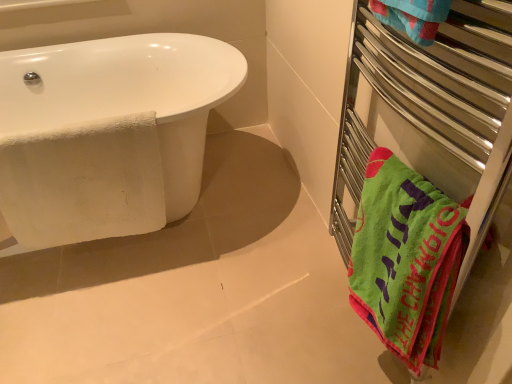
Question: Can you confirm if green soft towel at right is wider than green fabric towel at right?

Choices:
 (A) no
 (B) yes

Answer: (A)

Question: Considering the relative positions of green soft towel at right and green fabric towel at right in the image provided, is green soft towel at right to the right of green fabric towel at right from the viewer's perspective?

Choices:
 (A) no
 (B) yes

Answer: (A)

Question: Is there a large distance between green soft towel at right and green fabric towel at right?

Choices:
 (A) yes
 (B) no

Answer: (B)

Question: Is green soft towel at right at the left side of green fabric towel at right?

Choices:
 (A) no
 (B) yes

Answer: (B)

Question: Does green soft towel at right have a lesser height compared to green fabric towel at right?

Choices:
 (A) yes
 (B) no

Answer: (A)

Question: Does green soft towel at right have a larger size compared to green fabric towel at right?

Choices:
 (A) no
 (B) yes

Answer: (A)

Question: Can you confirm if white textured towel at left is wider than green soft towel at right?

Choices:
 (A) no
 (B) yes

Answer: (A)

Question: Does white textured towel at left lie in front of green soft towel at right?

Choices:
 (A) yes
 (B) no

Answer: (B)

Question: Can you confirm if white textured towel at left is taller than green soft towel at right?

Choices:
 (A) yes
 (B) no

Answer: (A)

Question: Does white textured towel at left appear on the right side of green soft towel at right?

Choices:
 (A) yes
 (B) no

Answer: (B)

Question: Can you confirm if white textured towel at left is smaller than green soft towel at right?

Choices:
 (A) yes
 (B) no

Answer: (A)

Question: Considering the relative positions of white textured towel at left and green soft towel at right in the image provided, is white textured towel at left to the left of green soft towel at right from the viewer's perspective?

Choices:
 (A) no
 (B) yes

Answer: (B)

Question: Does white textured towel at left touch white glossy bathtub at left?

Choices:
 (A) yes
 (B) no

Answer: (B)